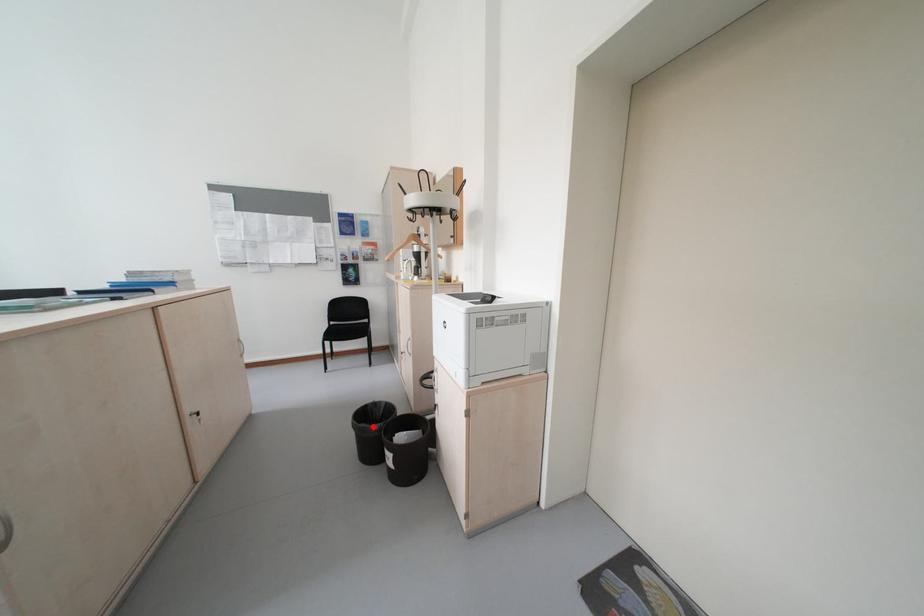
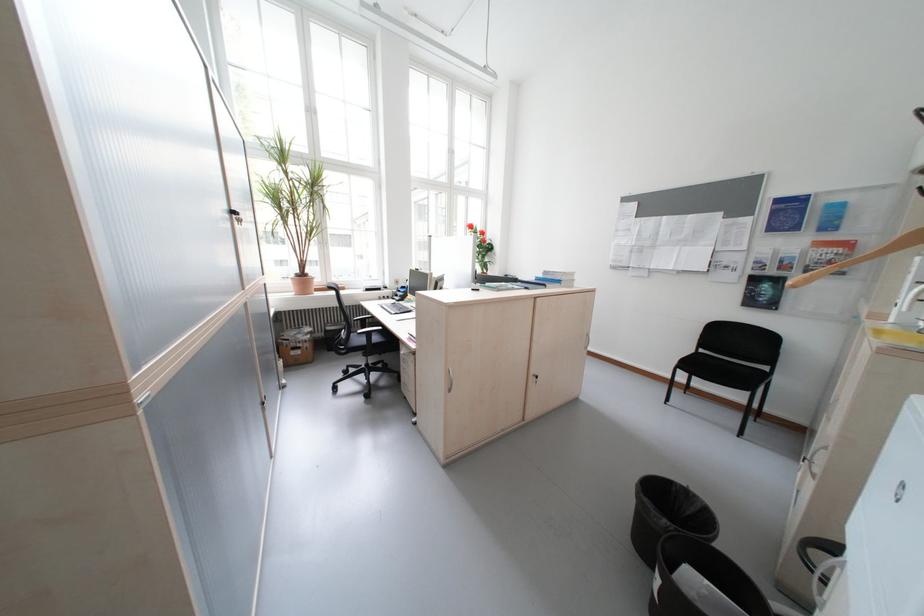
Find the pixel in the second image that matches the highlighted location in the first image.

(655, 501)